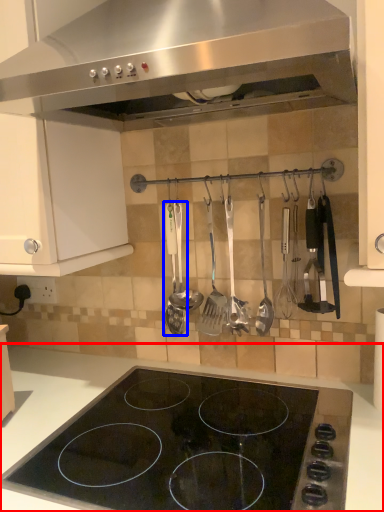
Question: Which object appears closest to the camera in this image, countertop (highlighted by a red box) or silverware (highlighted by a blue box)?

Choices:
 (A) countertop
 (B) silverware

Answer: (A)